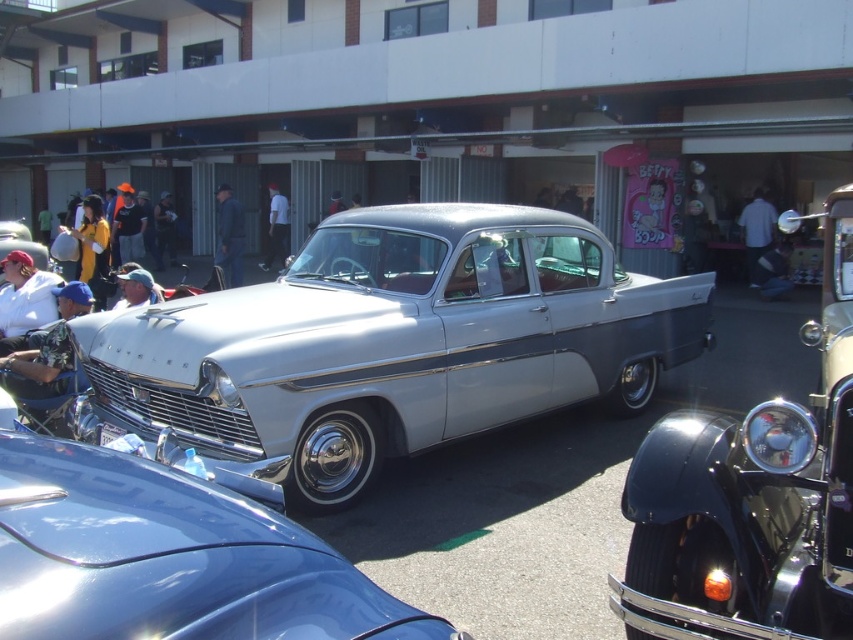
Looking at this image, you are a photographer at a classic car show and want to capture both the white fabric shirt at center and the matte silver pickup truck at center in a single frame. Which object will appear smaller in the photo?

The white fabric shirt at center will appear smaller in the photo because it has a smaller size compared to the matte silver pickup truck at center.

You are standing in the classic car show and see the white fabric shirt at center and the matte silver pickup truck at center. Which object is closer to the ground?

The white fabric shirt at center is positioned under the matte silver pickup truck at center, so it is closer to the ground.

You are a photographer standing at the camera position. You want to capture a photo of the silver metallic car at center. The recommended minimum distance for sharp focus on this camera is 4 meters. Will you need to step back to ensure the car is in focus?

The silver metallic car at center and camera are 4.10 meters apart from each other, which is just above the recommended minimum distance of 4 meters. Therefore, you do not need to step back further as the current distance is sufficient for sharp focus.